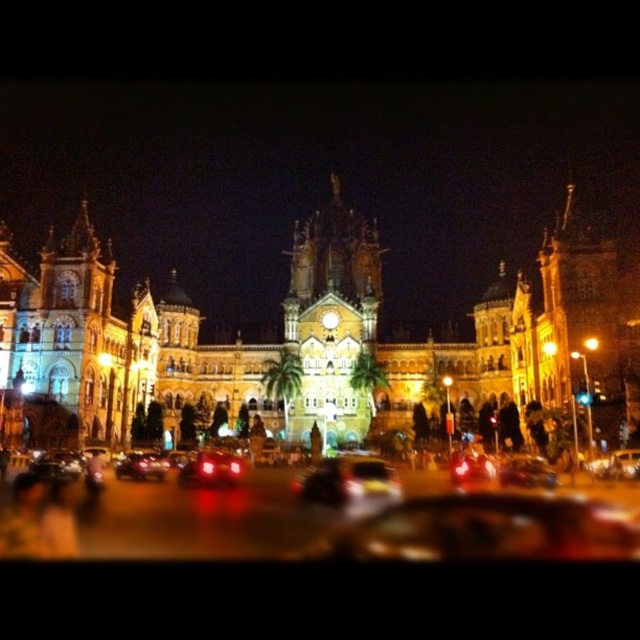
You are a photographer standing at the corner of the street, and you want to capture the central tower of the building in your shot. There is a shiny black car at center represented by point (x=490, y=529). Will this car block your view of the central tower?

The shiny black car at center represented by point (x=490, y=529) is located at the center of the image. Since the central tower is also positioned centrally in the building, the car may obstruct the view of the central tower depending on the camera angle and distance. However, without specific information about the car and tower positions relative to each other, it is impossible to determine if the car will block the view.

You are standing on the sidewalk in front of the grand illuminated building and see two cars, a shiny black car at center and a shiny red car at center. Which car is nearer to you?

The shiny black car at center is closer to the viewer than the shiny red car at center.

You are standing in front of the illuminated building and want to take a photo that includes both the central tower and the street below. Which point, point [380,264] or point [129,461], is closer to you and should be framed first in your camera view?

Point [380,264] is closer to you than point [129,461], so you should frame it first in your camera view to ensure both the central tower and the street are captured properly.